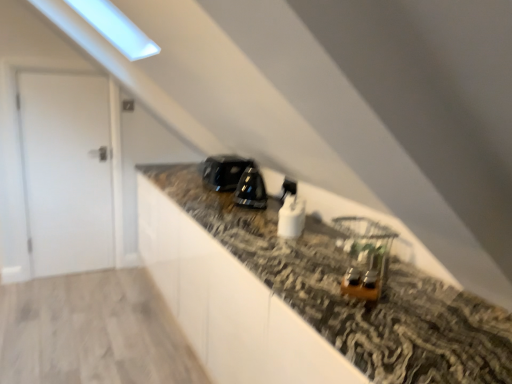
I want to click on free spot above white matte door at left (from a real-world perspective), so click(x=53, y=66).